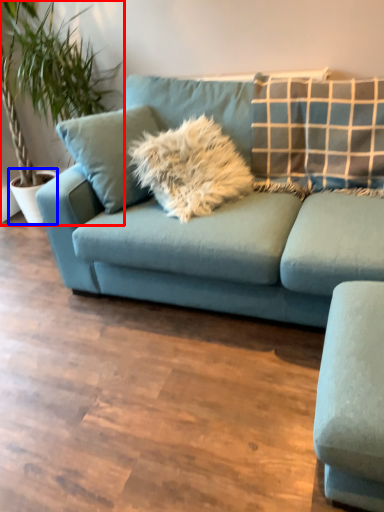
Question: Which of the following is the closest to the observer, houseplant (highlighted by a red box) or flowerpot (highlighted by a blue box)?

Choices:
 (A) houseplant
 (B) flowerpot

Answer: (A)